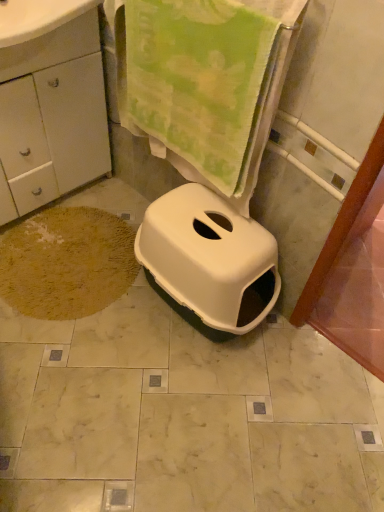
I want to click on white glossy drawer at upper left, so click(x=52, y=47).

What is the approximate height of white plastic litter box at center?

16.77 inches.

This screenshot has height=512, width=384. What do you see at coordinates (67, 263) in the screenshot? I see `brown shaggy rug at lower left` at bounding box center [67, 263].

This screenshot has width=384, height=512. I want to click on green plush towel at upper center, so click(272, 81).

Which of these two, brown shaggy rug at lower left or green plush towel at upper center, is thinner?

With smaller width is green plush towel at upper center.

From the image's perspective, would you say brown shaggy rug at lower left is shown under green plush towel at upper center?

Indeed, from the image's perspective, brown shaggy rug at lower left is shown beneath green plush towel at upper center.

In the scene shown: Is there a large distance between brown shaggy rug at lower left and green plush towel at upper center?

That's not correct — brown shaggy rug at lower left is a little close to green plush towel at upper center.

Does white glossy drawer at upper left appear on the right side of white matte cabinet at lower left?

Yes.

You are a GUI agent. You are given a task and a screenshot of the screen. Output one action in this format:
    pyautogui.click(x=<x>, y=<y>)
    Task: Click on the bathroom cabinet located below the white glossy drawer at upper left (from the image's perspective)
    Image resolution: width=384 pixels, height=512 pixels.
    Given the screenshot: What is the action you would take?
    pyautogui.click(x=50, y=104)

Can you confirm if white glossy drawer at upper left is bigger than white matte cabinet at lower left?

No, white glossy drawer at upper left is not bigger than white matte cabinet at lower left.

Consider the image. Can you see white matte cabinet at lower left touching white plastic litter box at center?

white matte cabinet at lower left and white plastic litter box at center are clearly separated.

In the scene shown: Considering the relative sizes of white matte cabinet at lower left and white plastic litter box at center in the image provided, is white matte cabinet at lower left smaller than white plastic litter box at center?

Incorrect, white matte cabinet at lower left is not smaller in size than white plastic litter box at center.

Is white matte cabinet at lower left positioned beyond the bounds of white plastic litter box at center?

Yes, white matte cabinet at lower left is outside of white plastic litter box at center.

Between white matte cabinet at lower left and white plastic litter box at center, which one appears on the left side from the viewer's perspective?

From the viewer's perspective, white matte cabinet at lower left appears more on the left side.

Is white plastic litter box at center far away from green plush towel at upper center?

white plastic litter box at center is near green plush towel at upper center, not far away.

How distant is white plastic litter box at center from green plush towel at upper center?

They are 10.63 inches apart.

Which of these two, white plastic litter box at center or green plush towel at upper center, is smaller?

With smaller size is green plush towel at upper center.

From the picture: From the image's perspective, would you say white plastic litter box at center is positioned over green plush towel at upper center?

Incorrect, from the image's perspective, white plastic litter box at center is lower than green plush towel at upper center.

Which of these two, white plastic litter box at center or white glossy drawer at upper left, stands taller?

With more height is white plastic litter box at center.

In the scene shown: Is white plastic litter box at center facing away from white glossy drawer at upper left?

No, white plastic litter box at center is not facing away from white glossy drawer at upper left.

Who is bigger, white plastic litter box at center or white glossy drawer at upper left?

With larger size is white plastic litter box at center.

Measure the distance between white plastic litter box at center and white glossy drawer at upper left.

white plastic litter box at center and white glossy drawer at upper left are 32.79 inches apart from each other.

From a real-world perspective, between green plush towel at upper center and white plastic litter box at center, who is vertically higher?

green plush towel at upper center is physically above.

Which is more to the left, green plush towel at upper center or white plastic litter box at center?

green plush towel at upper center.

From the picture: Is white plastic litter box at center completely or partially inside green plush towel at upper center?

No, white plastic litter box at center is not a part of green plush towel at upper center.

From the image's perspective, which one is positioned higher, white matte cabinet at lower left or green plush towel at upper center?

white matte cabinet at lower left appears higher in the image.

From the picture: Can you confirm if white matte cabinet at lower left is thinner than green plush towel at upper center?

Incorrect, the width of white matte cabinet at lower left is not less than that of green plush towel at upper center.

Considering the points (47, 114) and (247, 204), which point is behind, point (47, 114) or point (247, 204)?

The point (47, 114) is farther.

Which is in front, white matte cabinet at lower left or green plush towel at upper center?

green plush towel at upper center is more forward.

You are a GUI agent. You are given a task and a screenshot of the screen. Output one action in this format:
    pyautogui.click(x=<x>, y=<y>)
    Task: Click on the dirt behind the green plush towel at upper center
    
    Given the screenshot: What is the action you would take?
    pyautogui.click(x=67, y=263)

This screenshot has height=512, width=384. In order to click on drawer on the right side of white matte cabinet at lower left in this screenshot , I will do `click(52, 47)`.

Looking at the image, which one is located closer to white glossy drawer at upper left, green plush towel at upper center or white matte cabinet at lower left?

Based on the image, white matte cabinet at lower left appears to be nearer to white glossy drawer at upper left.

From the image, which object appears to be farther from green plush towel at upper center, white glossy drawer at upper left or white plastic litter box at center?

The object further to green plush towel at upper center is white glossy drawer at upper left.

Which object lies nearer to the anchor point white plastic litter box at center, white matte cabinet at lower left or brown shaggy rug at lower left?

brown shaggy rug at lower left lies closer to white plastic litter box at center than the other object.

Which object lies further to the anchor point white matte cabinet at lower left, white glossy drawer at upper left or green plush towel at upper center?

The object further to white matte cabinet at lower left is green plush towel at upper center.

Looking at the image, which one is located closer to white matte cabinet at lower left, green plush towel at upper center or white plastic litter box at center?

green plush towel at upper center is positioned closer to the anchor white matte cabinet at lower left.

Based on their spatial positions, is green plush towel at upper center or white glossy drawer at upper left further from brown shaggy rug at lower left?

The object further to brown shaggy rug at lower left is white glossy drawer at upper left.

Looking at the image, which one is located further to white matte cabinet at lower left, brown shaggy rug at lower left or white glossy drawer at upper left?

The object further to white matte cabinet at lower left is brown shaggy rug at lower left.

Estimate the real-world distances between objects in this image. Which object is further from white glossy drawer at upper left, brown shaggy rug at lower left or green plush towel at upper center?

brown shaggy rug at lower left is positioned further to the anchor white glossy drawer at upper left.

I want to click on dirt situated between white matte cabinet at lower left and white plastic litter box at center from left to right, so click(x=67, y=263).

I want to click on beach towel between white glossy drawer at upper left and brown shaggy rug at lower left from top to bottom, so click(272, 81).

The image size is (384, 512). What are the coordinates of `drawer located between white matte cabinet at lower left and green plush towel at upper center in the left-right direction` in the screenshot? It's located at (52, 47).

I want to click on beach towel between white glossy drawer at upper left and white plastic litter box at center in the vertical direction, so tap(272, 81).